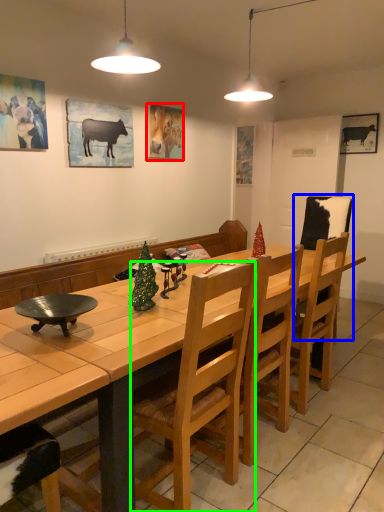
Question: Which object is positioned closest to picture frame (highlighted by a red box)? Select from armchair (highlighted by a blue box) and chair (highlighted by a green box).

Choices:
 (A) armchair
 (B) chair

Answer: (A)